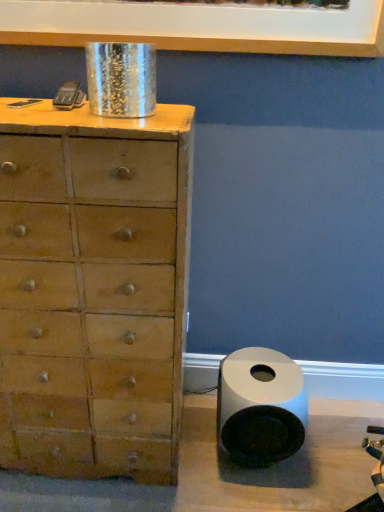
Where is `free area in between wooden chest of drawers at left and white glossy speaker at lower right`? This screenshot has height=512, width=384. free area in between wooden chest of drawers at left and white glossy speaker at lower right is located at coordinates (202, 454).